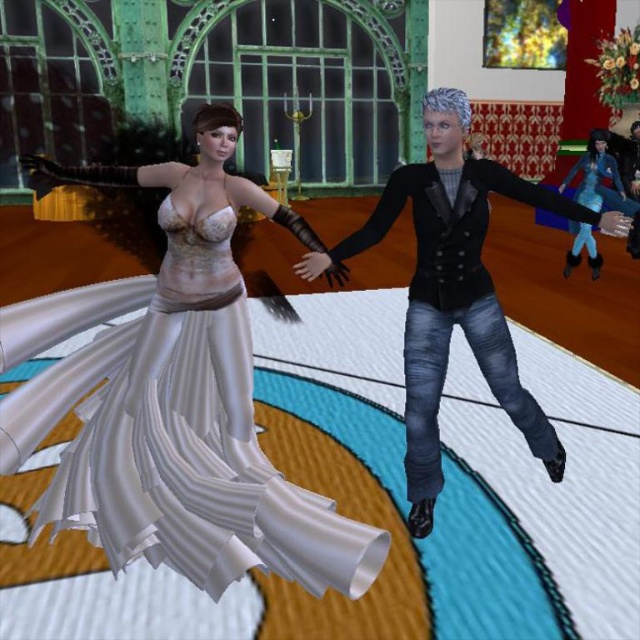
Question: Observing the image, what is the correct spatial positioning of white satin dress at center in reference to denim jeans at center?

Choices:
 (A) above
 (B) below

Answer: (B)

Question: Is white satin dress at center to the left of denim jeans at center from the viewer's perspective?

Choices:
 (A) yes
 (B) no

Answer: (A)

Question: Which of the following is the farthest from the observer?

Choices:
 (A) (484, 291)
 (B) (211, 186)

Answer: (B)

Question: Is white satin dress at center below denim jeans at center?

Choices:
 (A) no
 (B) yes

Answer: (B)